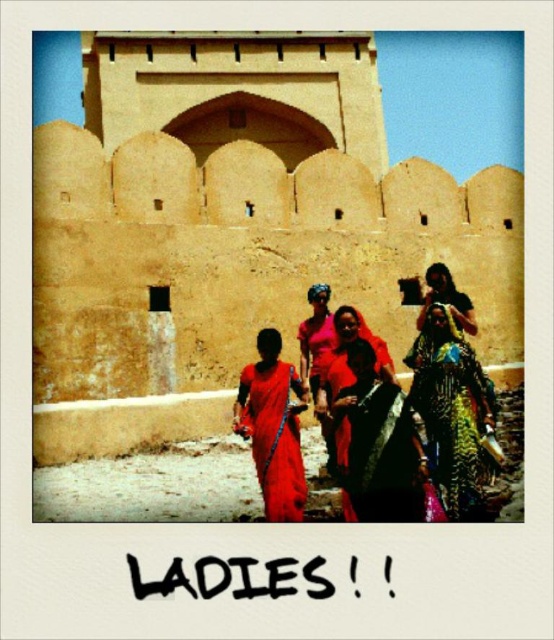
How much distance is there between shiny gold dress at right and matte red sari at center?

shiny gold dress at right is 16.86 feet from matte red sari at center.

Does point (463, 413) come behind point (286, 465)?

Yes, it is.

I want to click on shiny gold dress at right, so click(453, 413).

Which is more to the right, beige stone wall at center or shiny gold dress at right?

From the viewer's perspective, beige stone wall at center appears more on the right side.

Can you confirm if beige stone wall at center is positioned to the right of shiny gold dress at right?

Yes, beige stone wall at center is to the right of shiny gold dress at right.

Image resolution: width=554 pixels, height=640 pixels. Describe the element at coordinates (249, 216) in the screenshot. I see `beige stone wall at center` at that location.

At what (x,y) coordinates should I click in order to perform the action: click on beige stone wall at center. Please return your answer as a coordinate pair (x, y). The width and height of the screenshot is (554, 640). Looking at the image, I should click on [x=249, y=216].

In the scene shown: Does beige stone wall at center appear over matte red sari at center?

Correct, beige stone wall at center is located above matte red sari at center.

Does point (442, 236) lie in front of point (244, 419)?

No, it is not.

Locate an element on the screen. beige stone wall at center is located at coordinates (249, 216).